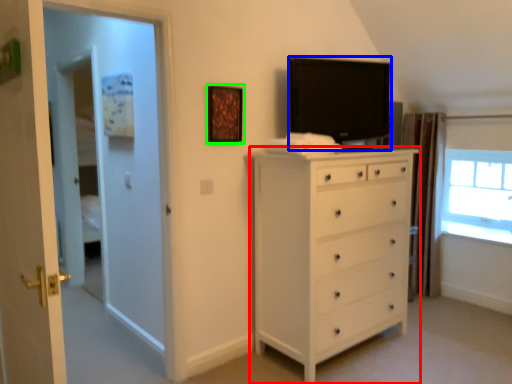
Question: Based on their relative distances, which object is nearer to chest of drawers (highlighted by a red box)? Choose from television (highlighted by a blue box) and picture frame (highlighted by a green box).

Choices:
 (A) television
 (B) picture frame

Answer: (A)